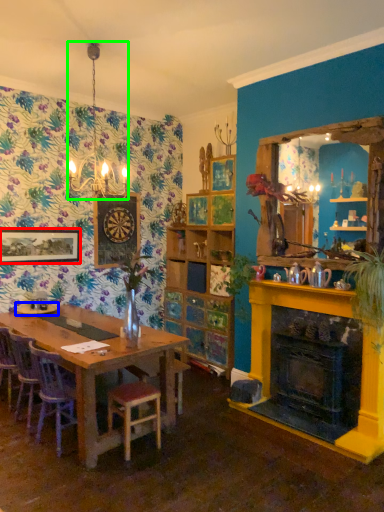
Question: Based on their relative distances, which object is nearer to picture frame (highlighted by a red box)? Choose from tableware (highlighted by a blue box) and lamp (highlighted by a green box).

Choices:
 (A) tableware
 (B) lamp

Answer: (A)